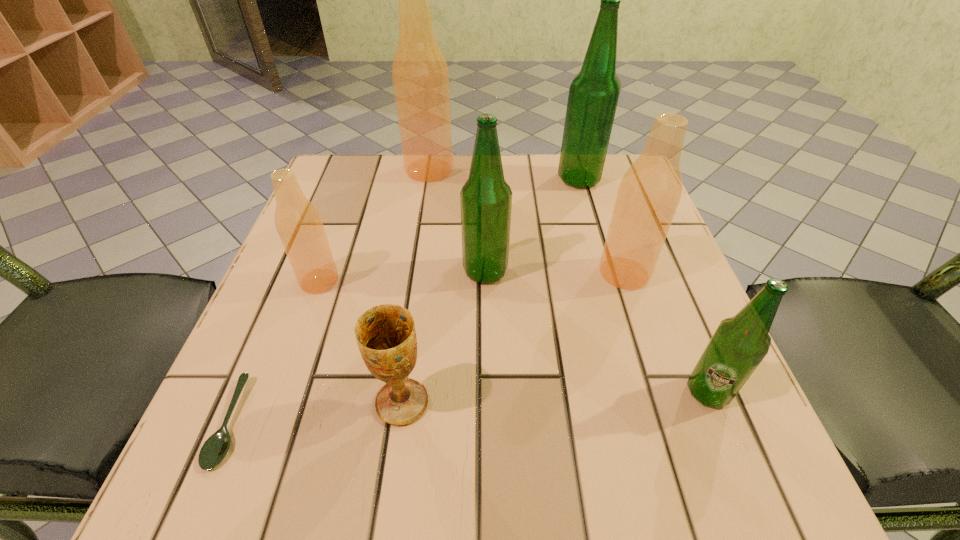
In the image, there is a desktop. Identify the location of vacant space at the far edge. (408, 201).

The image size is (960, 540). In order to click on vacant space at the near edge in this screenshot , I will do `click(564, 465)`.

Where is `vacant space at the left edge`? The height and width of the screenshot is (540, 960). vacant space at the left edge is located at coordinates (303, 384).

This screenshot has width=960, height=540. I want to click on vacant region at the right edge of the desktop, so click(x=701, y=418).

At what (x,y) coordinates should I click in order to perform the action: click on free space at the far left corner of the desktop. Please return your answer as a coordinate pair (x, y). Looking at the image, I should click on (375, 153).

Locate an element on the screen. This screenshot has height=540, width=960. vacant position at the near left corner of the desktop is located at coordinates (234, 453).

Locate an element on the screen. This screenshot has height=540, width=960. free space between the shortest object and the seventh tallest object is located at coordinates (316, 412).

You are a GUI agent. You are given a task and a screenshot of the screen. Output one action in this format:
    pyautogui.click(x=<x>, y=<y>)
    Task: Click on the free space between the smallest tan beer bottle and the biggest green beer bottle
    
    Given the screenshot: What is the action you would take?
    pyautogui.click(x=449, y=230)

Locate an element on the screen. Image resolution: width=960 pixels, height=540 pixels. unoccupied area between the farthest tan beer bottle and the biggest green beer bottle is located at coordinates (504, 174).

Where is `free point between the second smallest green beer bottle and the rightmost tan beer bottle`? The width and height of the screenshot is (960, 540). free point between the second smallest green beer bottle and the rightmost tan beer bottle is located at coordinates (555, 272).